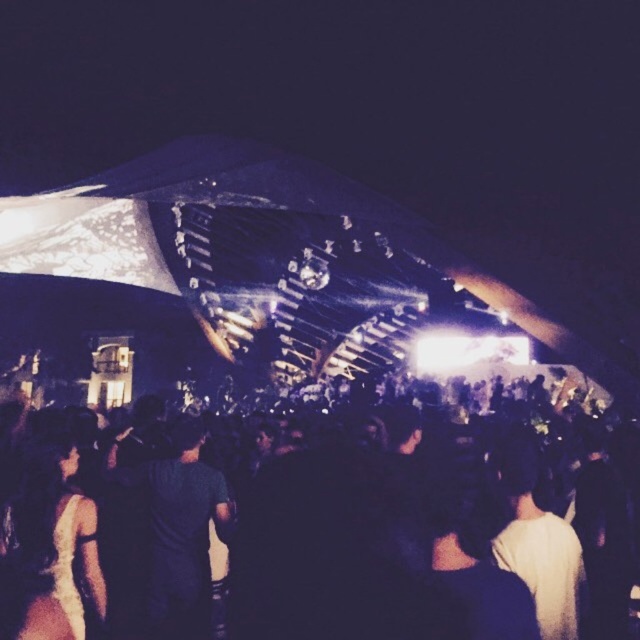
Question: Can you confirm if black matte crowd at center is wider than white matte dress at lower left?

Choices:
 (A) no
 (B) yes

Answer: (B)

Question: Which point is closer to the camera?

Choices:
 (A) dark gray shirt at center
 (B) black matte crowd at center
 (C) white matte dress at lower left

Answer: (B)

Question: Does dark gray shirt at center appear on the left side of white matte dress at lower left?

Choices:
 (A) yes
 (B) no

Answer: (B)

Question: Which point is closer to the camera?

Choices:
 (A) black matte crowd at center
 (B) dark gray shirt at center
 (C) white matte dress at lower left

Answer: (A)

Question: Considering the relative positions of black matte crowd at center and white matte dress at lower left in the image provided, where is black matte crowd at center located with respect to white matte dress at lower left?

Choices:
 (A) above
 (B) below

Answer: (A)

Question: Among these points, which one is nearest to the camera?

Choices:
 (A) (218, 528)
 (B) (99, 605)
 (C) (150, 604)

Answer: (B)